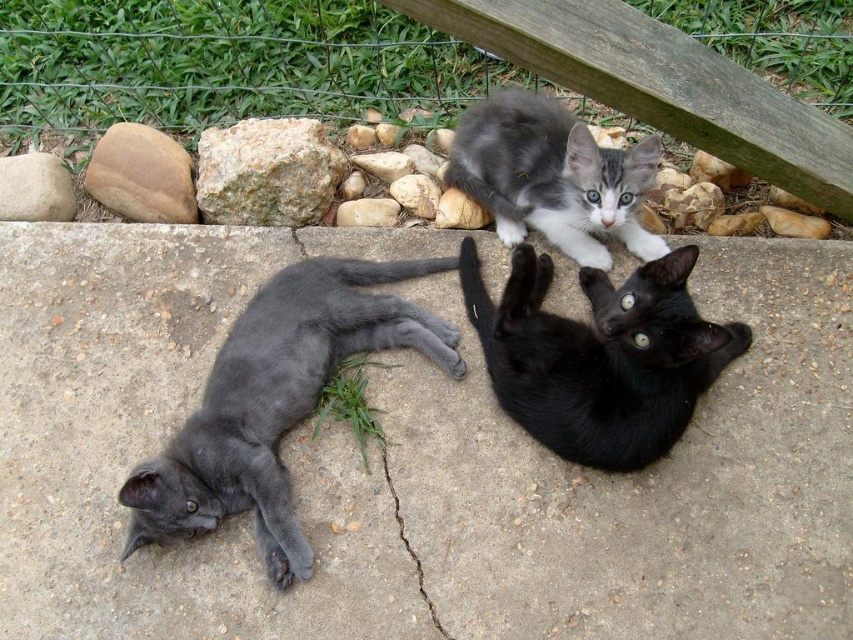
You are a photographer setting up a shot of the kittens. You want to place a small tripod between the wooden at upper right and the smooth brown rock at left so that it doesn

The smooth brown rock at left is behind the wooden at upper right, so placing the tripod between them would require positioning it in front of the smooth brown rock at left and behind the wooden at upper right. However, since the rock is behind the wooden object, there might not be enough space between them for the tripod. Check the distance between them before placing it.

You are a photographer setting up a shot of the kittens. You need to place a small tripod between the wooden at upper right and the smooth brown rock at left so that it is equidistant from both objects. Is this possible given their positions?

The wooden at upper right is to the right of the smooth brown rock at left, so placing the tripod exactly halfway between them would make it equidistant from both objects. Yes, this is possible.